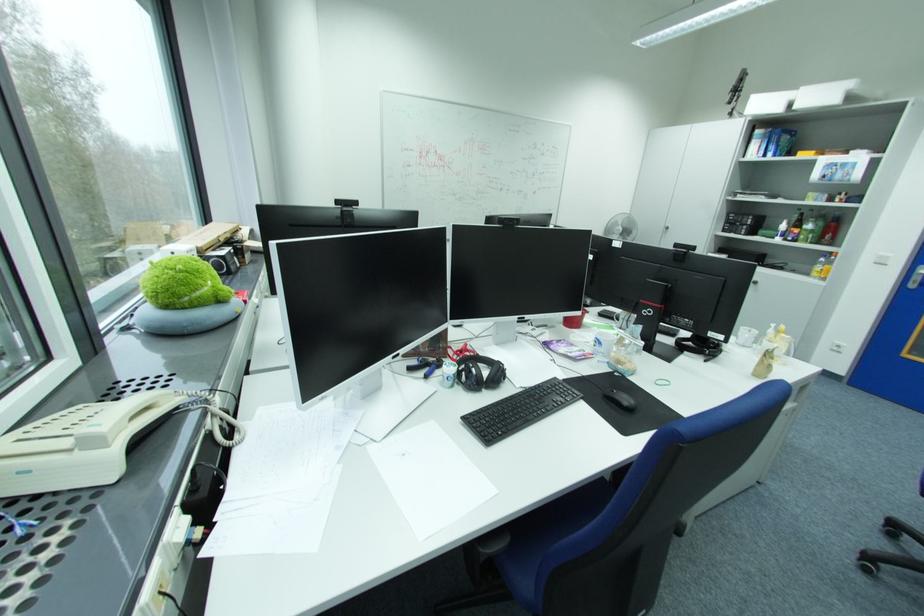
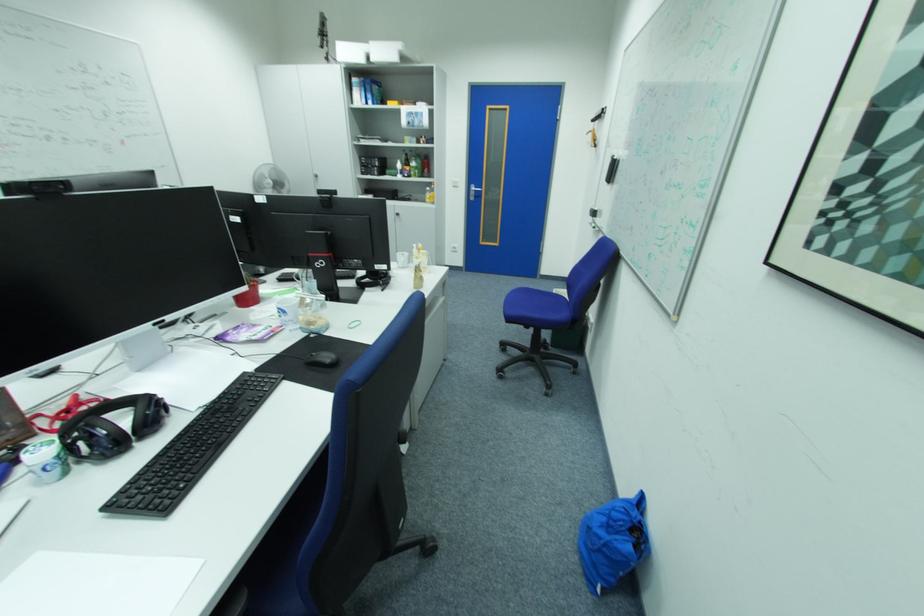
Question: The first image is from the beginning of the video and the second image is from the end. How did the camera likely rotate when shooting the video?

Choices:
 (A) Left
 (B) Right
 (C) Up
 (D) Down

Answer: (B)